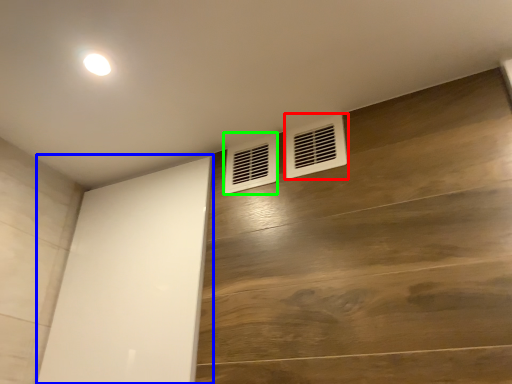
Question: Based on their relative distances, which object is nearer to air conditioning (highlighted by a red box)? Choose from screen door (highlighted by a blue box) and air conditioning (highlighted by a green box).

Choices:
 (A) screen door
 (B) air conditioning

Answer: (B)